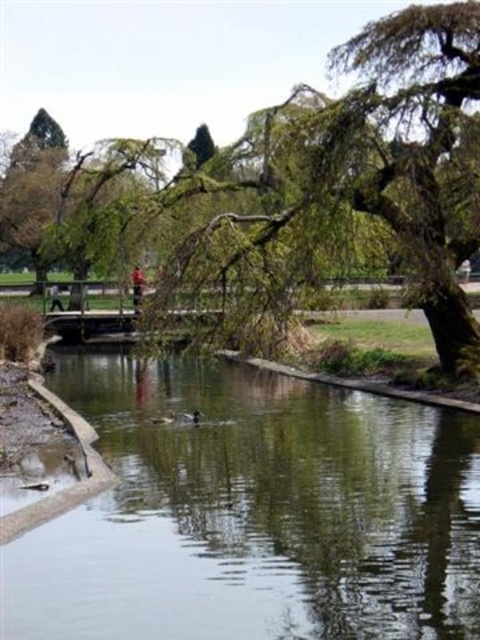
Which is in front, point (280, 528) or point (405, 266)?

Positioned in front is point (280, 528).

Is clear water at center to the right of green leafy tree at center from the viewer's perspective?

Indeed, clear water at center is positioned on the right side of green leafy tree at center.

Locate an element on the screen. This screenshot has height=640, width=480. clear water at center is located at coordinates click(253, 513).